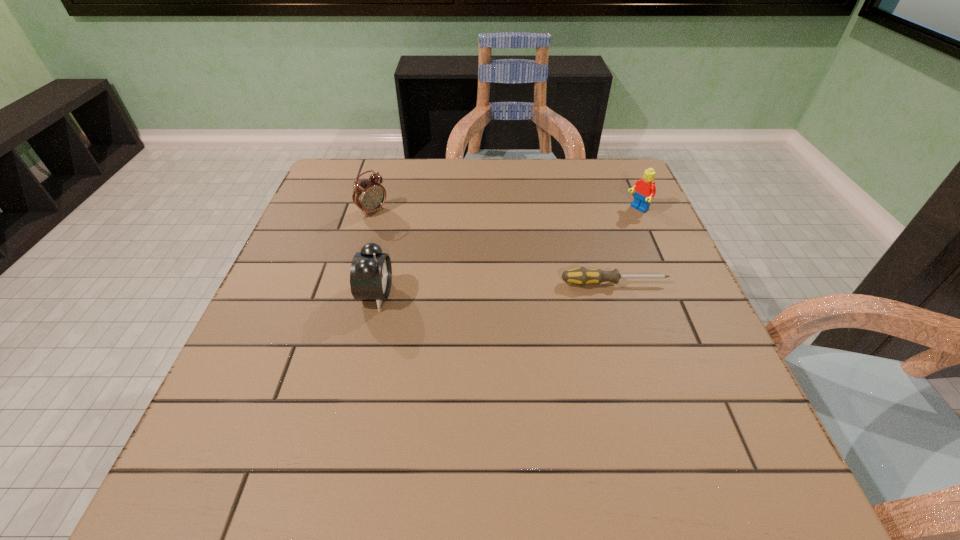
Identify the location of free space on the desktop that is between the nearer alarm clock and the screwdriver and is positioned on the face of the farther alarm clock. pyautogui.click(x=480, y=290).

Where is `free spot on the desktop that is between the nearer alarm clock and the screwdriver and is positioned on the face of the Lego`? free spot on the desktop that is between the nearer alarm clock and the screwdriver and is positioned on the face of the Lego is located at coordinates (507, 288).